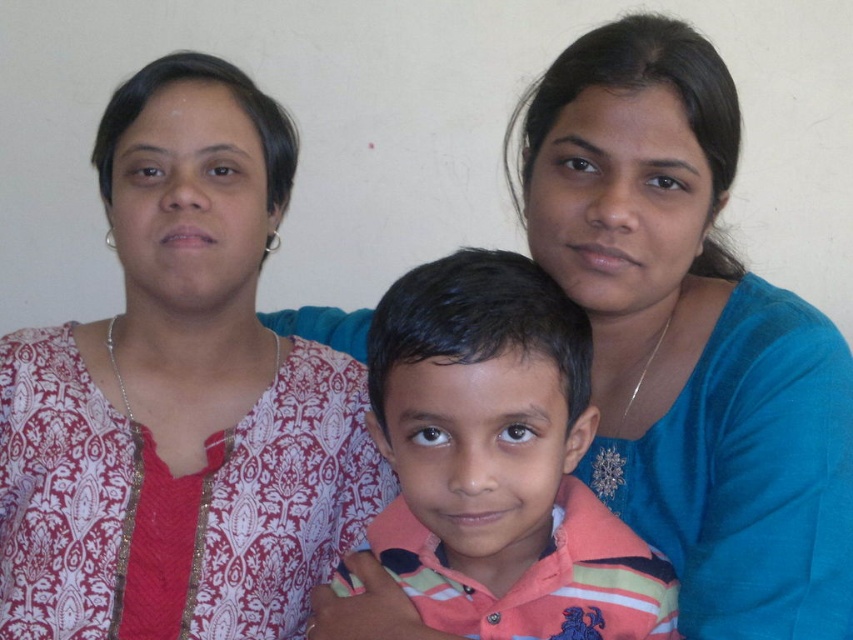
You are a photographer setting up for a group photo. You need to ensure that the patterned fabric shirt at left and the blue fabric at upper right are at least 14 inches apart to avoid overlapping in the photo. Based on the current setup, will their distance meet this requirement?

The distance between the patterned fabric shirt at left and the blue fabric at upper right is 13.55 inches, which is less than the required 14 inches. Therefore, their current distance does not meet the requirement to avoid overlapping in the photo.

You are organizing a clothing donation drive and need to determine which item takes up more space in the donation box. Based on the image, which item is larger in size between the blue fabric at upper right and the striped cotton shirt at center?

The blue fabric at upper right is larger in size than the striped cotton shirt at center, so it takes up more space in the donation box.